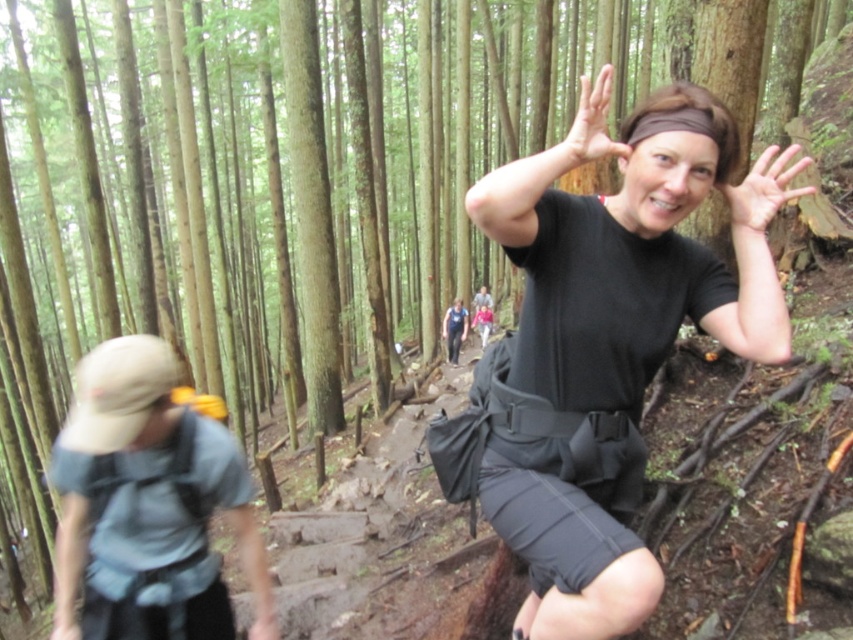
You are standing on the narrow, rocky trail in the forest and see two points marked in the image. The first point is at coordinate point (128, 515) and the second point is at coordinate point (752, 179). Which point is closer to you?

Point (128, 515) is closer to you because it is further to the viewer than point (752, 179).

In the forest scene, there is a woman wearing a black t shirt and a headband, and a point marked at coordinates (149, 502). What is the color of the clothing item located at that point?

The point at (149, 502) indicates a light blue fabric shirt at left, so the clothing item there is light blue.